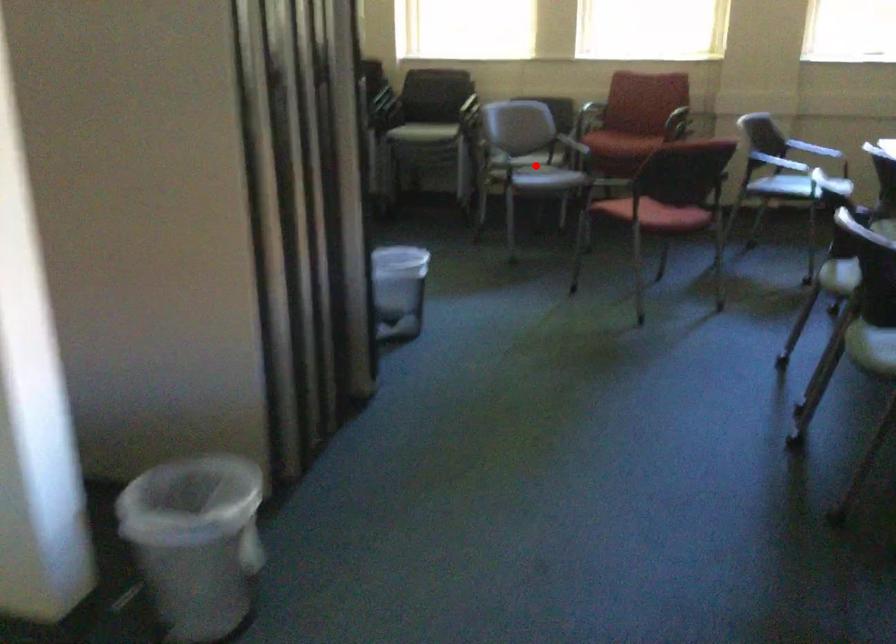
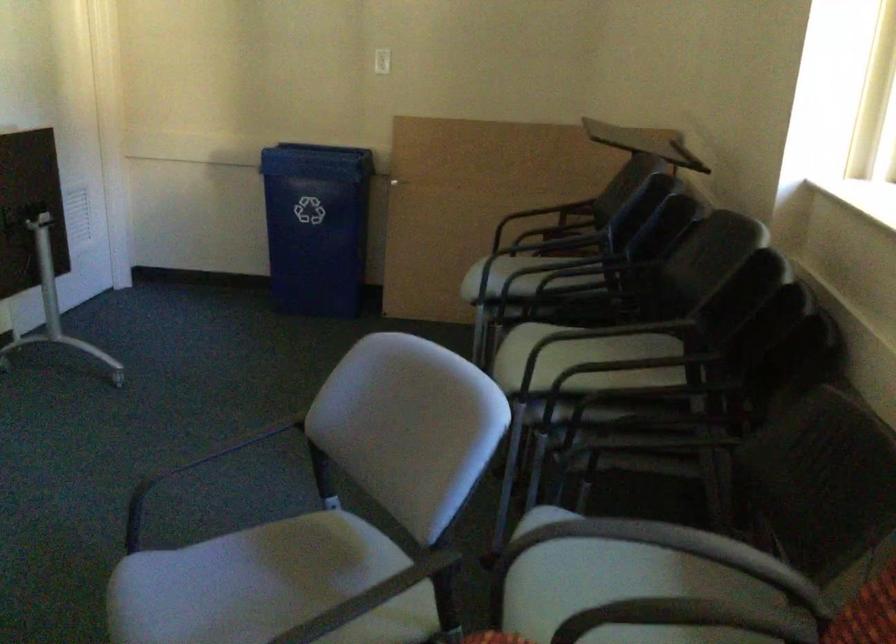
The point at the highlighted location is marked in the first image. Where is the corresponding point in the second image?

(271, 565)